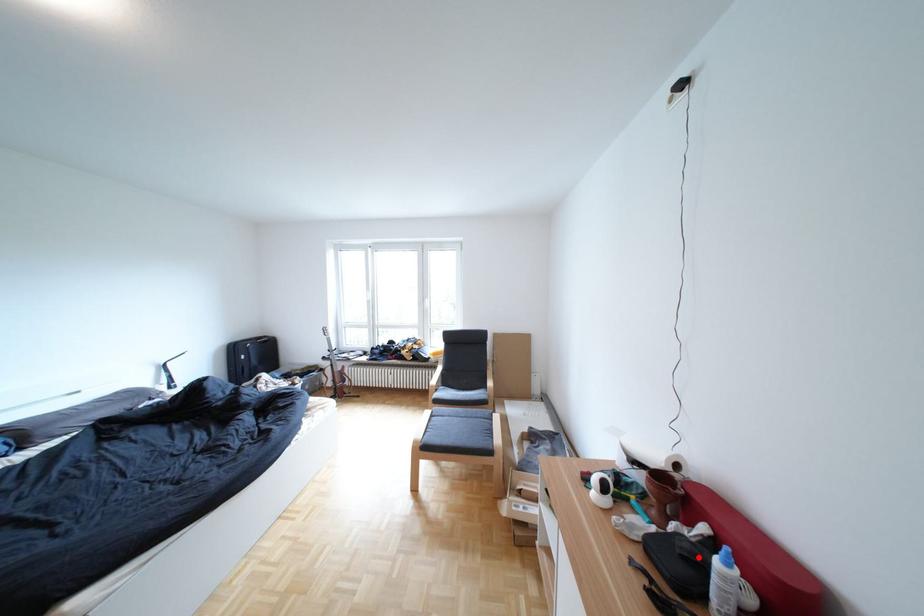
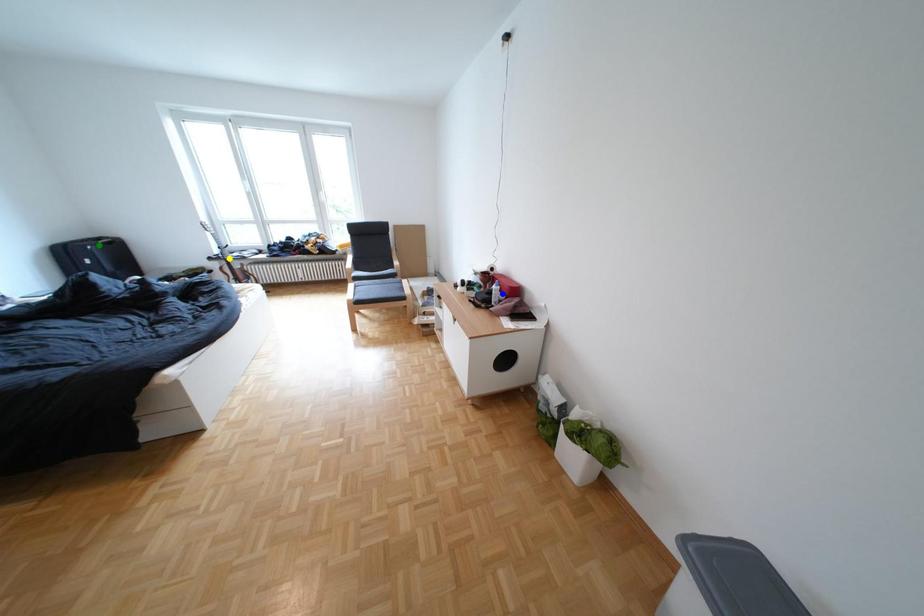
Question: I am providing you with two images of the same scene from different viewpoints. A red point is marked on the first image. You are given multiple points on the second image. Can you choose the point in image 2 that corresponds to the point in image 1?

Choices:
 (A) green point
 (B) yellow point
 (C) blue point

Answer: (C)